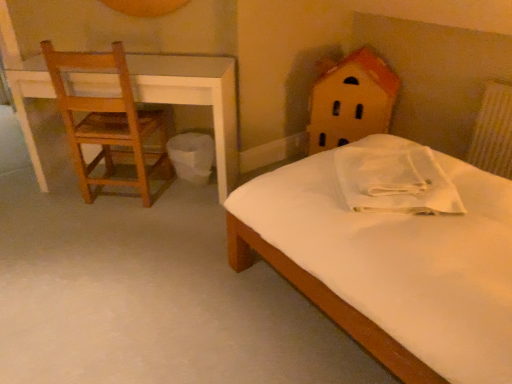
Locate an element on the screen. free spot below white plastic trash bin at lower center (from a real-world perspective) is located at coordinates (186, 190).